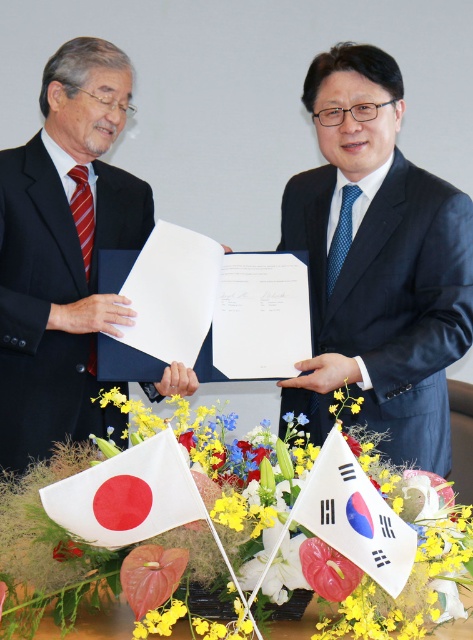
You are a photographer at a formal event. You need to capture a photo of the black matte suit at center and the black satin suit at left. Which one is closer to the camera?

The black matte suit at center is closer to the camera because it is in front of the black satin suit at left.

You are a photographer at the event and need to adjust the lighting so that the yellow fabric flower at center is illuminated more than the black satin suit at left. Since the flower is smaller, you decide to place the light closer to it. Will this adjustment ensure the flower receives more light than the suit?

The yellow fabric flower at center is not as tall as the black satin suit at left, so placing the light closer to the flower may help illuminate it more effectively compared to the taller suit.

You are a photographer at a formal event. You need to position yourself to capture a photo of both the black matte suit at center and the black satin suit at left. Since you want to ensure both are fully visible in the frame, which subject should you focus on first to avoid cropping either?

The black matte suit at center is taller than the black satin suit at left, so you should focus on positioning the camera to accommodate the height of the black matte suit at center first to ensure both are fully visible.